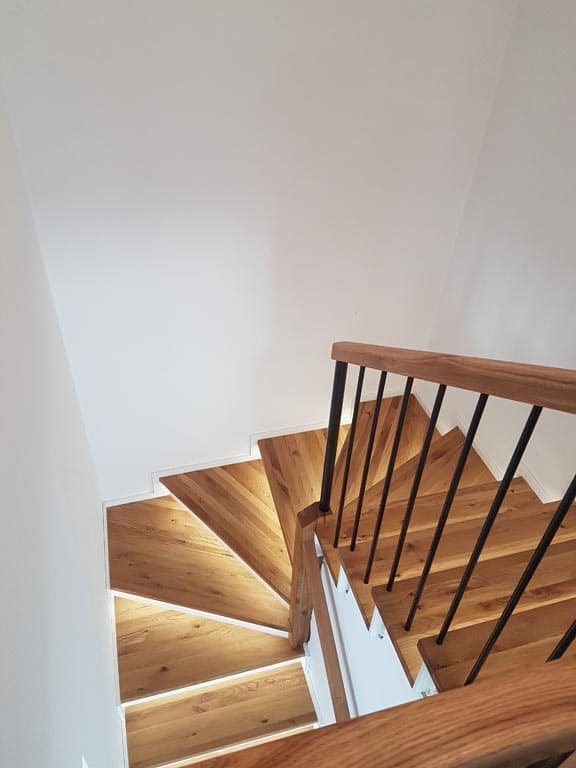
The image size is (576, 768). I want to click on walls, so click(x=537, y=285), click(x=223, y=207), click(x=28, y=528), click(x=376, y=684).